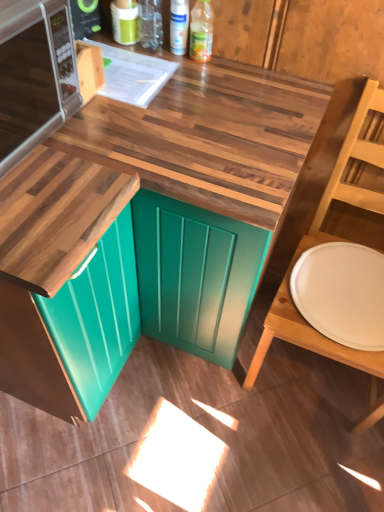
What is the approximate width of wooden at center?

wooden at center is 3.11 inches wide.

Measure the distance between point [250,170] and camera.

The depth of point [250,170] is 33.50 inches.

Measure the distance between white matte plate at right and camera.

white matte plate at right is 1.05 meters away from camera.

Locate an element on the screen. white glossy spray can at upper center, which appears as the first bottle when viewed from the left is located at coordinates (179, 26).

This screenshot has height=512, width=384. What do you see at coordinates (35, 76) in the screenshot?
I see `silver metallic microwave at upper left` at bounding box center [35, 76].

The height and width of the screenshot is (512, 384). Describe the element at coordinates (131, 221) in the screenshot. I see `wooden at center` at that location.

The width and height of the screenshot is (384, 512). What are the coordinates of `translucent plastic bottle at upper center, which is the second bottle in left-to-right order` in the screenshot? It's located at (201, 31).

Locate an element on the screen. This screenshot has height=512, width=384. wooden at center is located at coordinates (212, 136).

From a real-world perspective, is wooden at center under white matte plate at right?

Correct, in the physical world, wooden at center is lower than white matte plate at right.

Are wooden at center and white matte plate at right beside each other?

They are not placed beside each other.

From the image's perspective, is wooden at center positioned above or below white matte plate at right?

Based on their image positions, wooden at center is located above white matte plate at right.

Image resolution: width=384 pixels, height=512 pixels. Find the location of `plate below the wooden at center (from the image's perspective)`. plate below the wooden at center (from the image's perspective) is located at coordinates (342, 293).

Which of these two, white glossy spray can at upper center, positioned as the second bottle in right-to-left order, or wooden at center, is smaller?

With smaller size is white glossy spray can at upper center, positioned as the second bottle in right-to-left order.

Is white glossy spray can at upper center, which appears as the first bottle when viewed from the left, turned away from wooden at center?

No, white glossy spray can at upper center, which appears as the first bottle when viewed from the left, is not facing the opposite direction of wooden at center.

Locate an element on the screen. bottle that is the 2nd object located behind the wooden at center is located at coordinates (179, 26).

From the image's perspective, is white glossy spray can at upper center, which appears as the first bottle when viewed from the left, positioned above or below wooden at center?

Clearly, from the image's perspective, white glossy spray can at upper center, which appears as the first bottle when viewed from the left, is above wooden at center.

At what (x,y) coordinates should I click in order to perform the action: click on countertop above the teal glossy cabinet at lower left (from the image's perspective). Please return your answer as a coordinate pair (x, y). Looking at the image, I should click on (131, 221).

Between teal glossy cabinet at lower left and wooden at center, which one has smaller width?

wooden at center is thinner.

What's the angular difference between teal glossy cabinet at lower left and wooden at center's facing directions?

There is a 90-degree angle between the facing directions of teal glossy cabinet at lower left and wooden at center.

Is teal glossy cabinet at lower left further to the viewer compared to wooden at center?

That is False.

Considering the sizes of objects silver metallic microwave at upper left and teal glossy cabinet at lower left in the image provided, who is shorter, silver metallic microwave at upper left or teal glossy cabinet at lower left?

silver metallic microwave at upper left is shorter.

Is silver metallic microwave at upper left directly adjacent to teal glossy cabinet at lower left?

silver metallic microwave at upper left and teal glossy cabinet at lower left are clearly separated.

Do you think silver metallic microwave at upper left is within teal glossy cabinet at lower left, or outside of it?

silver metallic microwave at upper left is not inside teal glossy cabinet at lower left, it's outside.

From the image's perspective, which is below, silver metallic microwave at upper left or teal glossy cabinet at lower left?

teal glossy cabinet at lower left appears lower in the image.

Is wooden at center far from teal glossy cabinet at lower left?

That's not correct — wooden at center is a little close to teal glossy cabinet at lower left.

From the image's perspective, is wooden at center above teal glossy cabinet at lower left?

Yes, from the image's perspective, wooden at center is on top of teal glossy cabinet at lower left.

How different are the orientations of wooden at center and teal glossy cabinet at lower left in degrees?

90 degrees separate the facing orientations of wooden at center and teal glossy cabinet at lower left.

Is wooden chair at right to the left of white glossy spray can at upper center, positioned as the second bottle in right-to-left order, from the viewer's perspective?

In fact, wooden chair at right is to the right of white glossy spray can at upper center, positioned as the second bottle in right-to-left order.

Considering the positions of point (293, 331) and point (175, 6), is point (293, 331) closer or farther from the camera than point (175, 6)?

Point (293, 331) appears to be farther away from the viewer than point (175, 6).

Is wooden chair at right outside of white glossy spray can at upper center, which appears as the first bottle when viewed from the left?

Absolutely, wooden chair at right is external to white glossy spray can at upper center, which appears as the first bottle when viewed from the left.

Is wooden chair at right in front of or behind white glossy spray can at upper center, positioned as the second bottle in right-to-left order, in the image?

wooden chair at right is in front of white glossy spray can at upper center, positioned as the second bottle in right-to-left order.

Is translucent plastic bottle at upper center, which is the second bottle in left-to-right order, completely or partially outside of white matte plate at right?

Yes, translucent plastic bottle at upper center, which is the second bottle in left-to-right order, is not within white matte plate at right.

Find the location of a particular element. The image size is (384, 512). plate below the translucent plastic bottle at upper center, which is the second bottle in left-to-right order (from the image's perspective) is located at coordinates (342, 293).

Is translucent plastic bottle at upper center, which is the first bottle from right to left, facing away from white matte plate at right?

translucent plastic bottle at upper center, which is the first bottle from right to left, is not turned away from white matte plate at right.

Does point (200, 20) appear closer or farther from the camera than point (297, 285)?

Point (200, 20).

Locate an element on the screen. This screenshot has width=384, height=512. countertop below the white matte plate at right (from a real-world perspective) is located at coordinates (131, 221).

This screenshot has height=512, width=384. In order to click on countertop on the left of the white glossy spray can at upper center, positioned as the second bottle in right-to-left order in this screenshot , I will do pos(131,221).

Based on their spatial positions, is wooden at center or translucent plastic bottle at upper center, which is the first bottle from right to left, closer to silver metallic microwave at upper left?

wooden at center is positioned closer to the anchor silver metallic microwave at upper left.

Which object lies nearer to the anchor point teal glossy cabinet at lower left, white glossy spray can at upper center, which appears as the first bottle when viewed from the left, or white matte plate at right?

Among the two, white matte plate at right is located nearer to teal glossy cabinet at lower left.

Consider the image. Considering their positions, is wooden at center positioned closer to wooden at center than white matte plate at right?

wooden at center is closer to wooden at center.

Based on their spatial positions, is wooden at center or white glossy spray can at upper center, which appears as the first bottle when viewed from the left, further from silver metallic microwave at upper left?

Among the two, white glossy spray can at upper center, which appears as the first bottle when viewed from the left, is located further to silver metallic microwave at upper left.

Considering their positions, is wooden chair at right positioned closer to silver metallic microwave at upper left than wooden at center?

wooden at center.

Based on their spatial positions, is teal glossy cabinet at lower left or white matte plate at right further from wooden at center?

Among the two, white matte plate at right is located further to wooden at center.

Looking at the image, which one is located further to white glossy spray can at upper center, which appears as the first bottle when viewed from the left, white matte plate at right or translucent plastic bottle at upper center, which is the second bottle in left-to-right order?

Based on the image, white matte plate at right appears to be further to white glossy spray can at upper center, which appears as the first bottle when viewed from the left.

Looking at the image, which one is located further to silver metallic microwave at upper left, wooden at center or translucent plastic bottle at upper center, which is the first bottle from right to left?

Based on the image, translucent plastic bottle at upper center, which is the first bottle from right to left, appears to be further to silver metallic microwave at upper left.

Locate an element on the screen. countertop situated between teal glossy cabinet at lower left and wooden chair at right from left to right is located at coordinates (131, 221).

Find the location of `bottle that lies between white glossy spray can at upper center, which appears as the first bottle when viewed from the left, and wooden at center from top to bottom`. bottle that lies between white glossy spray can at upper center, which appears as the first bottle when viewed from the left, and wooden at center from top to bottom is located at coordinates (201, 31).

Find the location of a particular element. The height and width of the screenshot is (512, 384). countertop between white glossy spray can at upper center, which appears as the first bottle when viewed from the left, and white matte plate at right vertically is located at coordinates (131, 221).

This screenshot has height=512, width=384. I want to click on countertop situated between teal glossy cabinet at lower left and white matte plate at right from left to right, so click(131, 221).